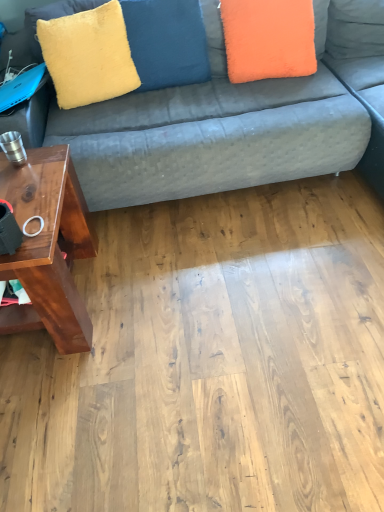
What do you see at coordinates (48, 247) in the screenshot? I see `brown wood table at left` at bounding box center [48, 247].

In order to face yellow plush pillow at upper center, positioned as the 2th pillow in right-to-left order, should I rotate leftwards or rightwards?

It's best to rotate left around 3.259 degrees.

Find the location of a particular element. orange fuzzy pillow at upper right, the 1th pillow in the right-to-left sequence is located at coordinates (268, 38).

At what (x,y) coordinates should I click in order to perform the action: click on brown wood table at left. Please return your answer as a coordinate pair (x, y). This screenshot has width=384, height=512. Looking at the image, I should click on (48, 247).

Is brown wood table at left far away from orange fuzzy pillow at upper right, the 1th pillow in the right-to-left sequence?

That's right, there is a large distance between brown wood table at left and orange fuzzy pillow at upper right, the 1th pillow in the right-to-left sequence.

Who is smaller, brown wood table at left or orange fuzzy pillow at upper right, the 1th pillow in the right-to-left sequence?

Smaller between the two is orange fuzzy pillow at upper right, the 1th pillow in the right-to-left sequence.

Can you confirm if brown wood table at left is shorter than orange fuzzy pillow at upper right, acting as the second pillow starting from the left?

No.

The width and height of the screenshot is (384, 512). In order to click on table located on the left of orange fuzzy pillow at upper right, acting as the second pillow starting from the left in this screenshot , I will do `click(48, 247)`.

Is velvet fabric couch at upper center bigger than orange fuzzy pillow at upper right, acting as the second pillow starting from the left?

Indeed, velvet fabric couch at upper center has a larger size compared to orange fuzzy pillow at upper right, acting as the second pillow starting from the left.

Is the position of velvet fabric couch at upper center more distant than that of orange fuzzy pillow at upper right, acting as the second pillow starting from the left?

No, velvet fabric couch at upper center is closer to the camera.

Locate an element on the screen. The height and width of the screenshot is (512, 384). studio couch below the orange fuzzy pillow at upper right, the 1th pillow in the right-to-left sequence (from a real-world perspective) is located at coordinates coord(236,121).

Is point (227, 150) closer to viewer compared to point (272, 23)?

Yes, it is.

From the image's perspective, which one is positioned lower, orange fuzzy pillow at upper right, acting as the second pillow starting from the left, or yellow fuzzy pillow at upper left?

yellow fuzzy pillow at upper left is shown below in the image.

Between orange fuzzy pillow at upper right, acting as the second pillow starting from the left, and yellow fuzzy pillow at upper left, which one has smaller width?

orange fuzzy pillow at upper right, acting as the second pillow starting from the left, is thinner.

Visually, is orange fuzzy pillow at upper right, the 1th pillow in the right-to-left sequence, positioned to the left or to the right of yellow fuzzy pillow at upper left?

orange fuzzy pillow at upper right, the 1th pillow in the right-to-left sequence, is to the right of yellow fuzzy pillow at upper left.

Is orange fuzzy pillow at upper right, the 1th pillow in the right-to-left sequence, aimed at brown wood table at left?

No, orange fuzzy pillow at upper right, the 1th pillow in the right-to-left sequence, does not turn towards brown wood table at left.

Considering the relative sizes of orange fuzzy pillow at upper right, the 1th pillow in the right-to-left sequence, and brown wood table at left in the image provided, is orange fuzzy pillow at upper right, the 1th pillow in the right-to-left sequence, taller than brown wood table at left?

No.

Can you tell me how much orange fuzzy pillow at upper right, the 1th pillow in the right-to-left sequence, and brown wood table at left differ in facing direction?

They differ by 98.7 degrees in their facing directions.

Measure the distance between orange fuzzy pillow at upper right, the 1th pillow in the right-to-left sequence, and brown wood table at left.

3.74 feet.

How different are the orientations of yellow plush pillow at upper center, acting as the 1th pillow starting from the left, and orange fuzzy pillow at upper right, the 1th pillow in the right-to-left sequence, in degrees?

yellow plush pillow at upper center, acting as the 1th pillow starting from the left, and orange fuzzy pillow at upper right, the 1th pillow in the right-to-left sequence, are facing 10.4 degrees away from each other.

Is yellow plush pillow at upper center, acting as the 1th pillow starting from the left, at the left side of orange fuzzy pillow at upper right, acting as the second pillow starting from the left?

Yes, yellow plush pillow at upper center, acting as the 1th pillow starting from the left, is to the left of orange fuzzy pillow at upper right, acting as the second pillow starting from the left.

Between point (150, 78) and point (260, 6), which one is positioned behind?

The point (150, 78) is farther.

Is yellow plush pillow at upper center, positioned as the 2th pillow in right-to-left order, not inside orange fuzzy pillow at upper right, the 1th pillow in the right-to-left sequence?

Yes, yellow plush pillow at upper center, positioned as the 2th pillow in right-to-left order, is located beyond the bounds of orange fuzzy pillow at upper right, the 1th pillow in the right-to-left sequence.

Can you confirm if yellow fuzzy pillow at upper left is thinner than orange fuzzy pillow at upper right, the 1th pillow in the right-to-left sequence?

In fact, yellow fuzzy pillow at upper left might be wider than orange fuzzy pillow at upper right, the 1th pillow in the right-to-left sequence.

Is yellow fuzzy pillow at upper left aimed at orange fuzzy pillow at upper right, acting as the second pillow starting from the left?

No, yellow fuzzy pillow at upper left is not facing towards orange fuzzy pillow at upper right, acting as the second pillow starting from the left.

From the image's perspective, is yellow fuzzy pillow at upper left located above or below orange fuzzy pillow at upper right, the 1th pillow in the right-to-left sequence?

yellow fuzzy pillow at upper left is situated lower than orange fuzzy pillow at upper right, the 1th pillow in the right-to-left sequence, in the image.

From a real-world perspective, is yellow fuzzy pillow at upper left positioned under orange fuzzy pillow at upper right, the 1th pillow in the right-to-left sequence, based on gravity?

No, from a real-world perspective, yellow fuzzy pillow at upper left is not under orange fuzzy pillow at upper right, the 1th pillow in the right-to-left sequence.

Can you confirm if orange fuzzy pillow at upper right, the 1th pillow in the right-to-left sequence, is bigger than yellow plush pillow at upper center, acting as the 1th pillow starting from the left?

No.

Is orange fuzzy pillow at upper right, the 1th pillow in the right-to-left sequence, not near yellow plush pillow at upper center, positioned as the 2th pillow in right-to-left order?

That's not correct — orange fuzzy pillow at upper right, the 1th pillow in the right-to-left sequence, is a little close to yellow plush pillow at upper center, positioned as the 2th pillow in right-to-left order.

From a real-world perspective, is orange fuzzy pillow at upper right, acting as the second pillow starting from the left, physically located above or below yellow plush pillow at upper center, acting as the 1th pillow starting from the left?

orange fuzzy pillow at upper right, acting as the second pillow starting from the left, is below yellow plush pillow at upper center, acting as the 1th pillow starting from the left.

In the scene shown: Which object is further away from the camera taking this photo, orange fuzzy pillow at upper right, acting as the second pillow starting from the left, or yellow plush pillow at upper center, acting as the 1th pillow starting from the left?

yellow plush pillow at upper center, acting as the 1th pillow starting from the left.

Where is `table in front of the orange fuzzy pillow at upper right, the 1th pillow in the right-to-left sequence`? This screenshot has width=384, height=512. table in front of the orange fuzzy pillow at upper right, the 1th pillow in the right-to-left sequence is located at coordinates (48, 247).

I want to click on pillow on the right side of velvet fabric couch at upper center, so click(268, 38).

In the scene shown: Based on their spatial positions, is velvet fabric couch at upper center or yellow plush pillow at upper center, positioned as the 2th pillow in right-to-left order, further from brown wood table at left?

Based on the image, yellow plush pillow at upper center, positioned as the 2th pillow in right-to-left order, appears to be further to brown wood table at left.

Based on their spatial positions, is brown wood table at left or yellow plush pillow at upper center, positioned as the 2th pillow in right-to-left order, closer to orange fuzzy pillow at upper right, the 1th pillow in the right-to-left sequence?

The object closer to orange fuzzy pillow at upper right, the 1th pillow in the right-to-left sequence, is yellow plush pillow at upper center, positioned as the 2th pillow in right-to-left order.

Looking at the image, which one is located further to yellow plush pillow at upper center, positioned as the 2th pillow in right-to-left order, orange fuzzy pillow at upper right, the 1th pillow in the right-to-left sequence, or velvet fabric couch at upper center?

velvet fabric couch at upper center is positioned further to the anchor yellow plush pillow at upper center, positioned as the 2th pillow in right-to-left order.

From the image, which object appears to be nearer to yellow fuzzy pillow at upper left, yellow plush pillow at upper center, acting as the 1th pillow starting from the left, or velvet fabric couch at upper center?

Based on the image, yellow plush pillow at upper center, acting as the 1th pillow starting from the left, appears to be nearer to yellow fuzzy pillow at upper left.

Looking at the image, which one is located closer to brown wood table at left, yellow plush pillow at upper center, positioned as the 2th pillow in right-to-left order, or yellow fuzzy pillow at upper left?

yellow fuzzy pillow at upper left is closer to brown wood table at left.

Looking at the image, which one is located further to yellow fuzzy pillow at upper left, brown wood table at left or yellow plush pillow at upper center, acting as the 1th pillow starting from the left?

brown wood table at left is further to yellow fuzzy pillow at upper left.

Which object lies further to the anchor point velvet fabric couch at upper center, yellow fuzzy pillow at upper left or orange fuzzy pillow at upper right, acting as the second pillow starting from the left?

yellow fuzzy pillow at upper left lies further to velvet fabric couch at upper center than the other object.

Looking at the image, which one is located closer to brown wood table at left, orange fuzzy pillow at upper right, the 1th pillow in the right-to-left sequence, or velvet fabric couch at upper center?

Among the two, velvet fabric couch at upper center is located nearer to brown wood table at left.

This screenshot has width=384, height=512. Identify the location of pillow between velvet fabric couch at upper center and yellow plush pillow at upper center, positioned as the 2th pillow in right-to-left order, from front to back. (268, 38).

Identify the location of pillow situated between yellow fuzzy pillow at upper left and orange fuzzy pillow at upper right, the 1th pillow in the right-to-left sequence, from left to right. (166, 42).

The height and width of the screenshot is (512, 384). In order to click on studio couch between brown wood table at left and orange fuzzy pillow at upper right, acting as the second pillow starting from the left, from left to right in this screenshot , I will do `click(236, 121)`.

Image resolution: width=384 pixels, height=512 pixels. I want to click on throw pillow between yellow plush pillow at upper center, acting as the 1th pillow starting from the left, and brown wood table at left, in the vertical direction, so click(x=88, y=55).